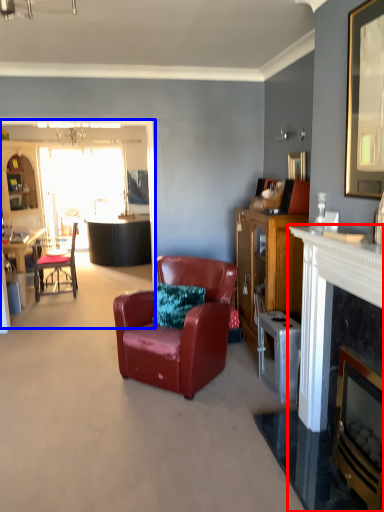
Question: Which object appears closest to the camera in this image, fireplace (highlighted by a red box) or entertainment center (highlighted by a blue box)?

Choices:
 (A) fireplace
 (B) entertainment center

Answer: (A)